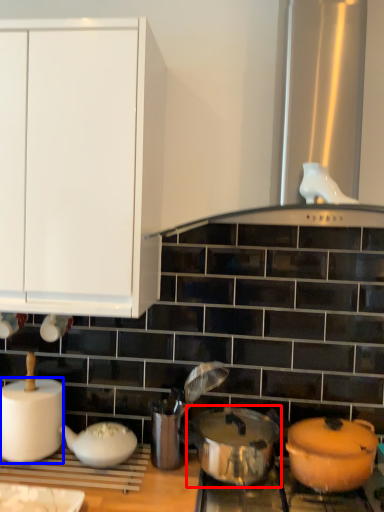
Question: Which object appears closest to the camera in this image, crock pot (highlighted by a red box) or paper towel (highlighted by a blue box)?

Choices:
 (A) crock pot
 (B) paper towel

Answer: (A)